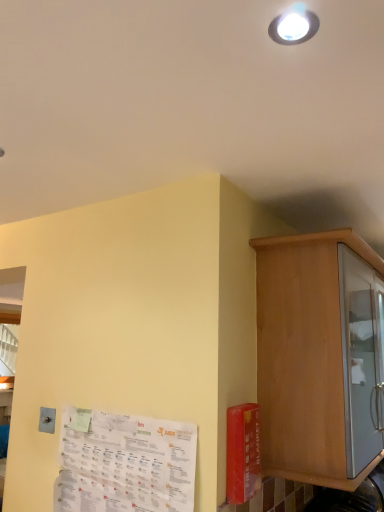
Question: In terms of width, does wooden cabinet at right look wider or thinner when compared to white paper at lower left?

Choices:
 (A) thin
 (B) wide

Answer: (B)

Question: From the image's perspective, is wooden cabinet at right positioned above or below white paper at lower left?

Choices:
 (A) below
 (B) above

Answer: (B)

Question: Considering the relative positions of wooden cabinet at right and white paper at lower left in the image provided, is wooden cabinet at right to the left or to the right of white paper at lower left?

Choices:
 (A) left
 (B) right

Answer: (B)

Question: Based on their positions, is white paper at lower left located to the left or right of wooden cabinet at right?

Choices:
 (A) left
 (B) right

Answer: (A)

Question: Is white paper at lower left spatially inside wooden cabinet at right, or outside of it?

Choices:
 (A) inside
 (B) outside

Answer: (B)

Question: From a real-world perspective, is white paper at lower left positioned above or below wooden cabinet at right?

Choices:
 (A) above
 (B) below

Answer: (B)

Question: From the image's perspective, is white paper at lower left above or below wooden cabinet at right?

Choices:
 (A) above
 (B) below

Answer: (B)